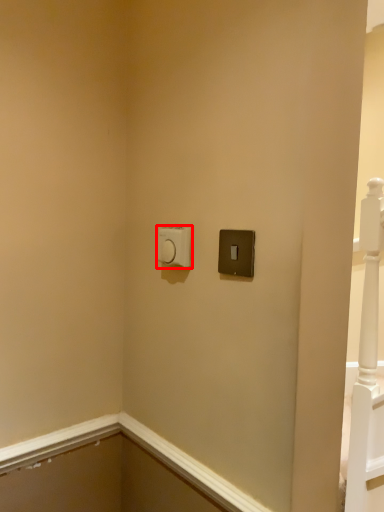
Question: From the image's perspective, what is the correct spatial positioning of light switch (annotated by the red box) in reference to light switch?

Choices:
 (A) below
 (B) above

Answer: (B)